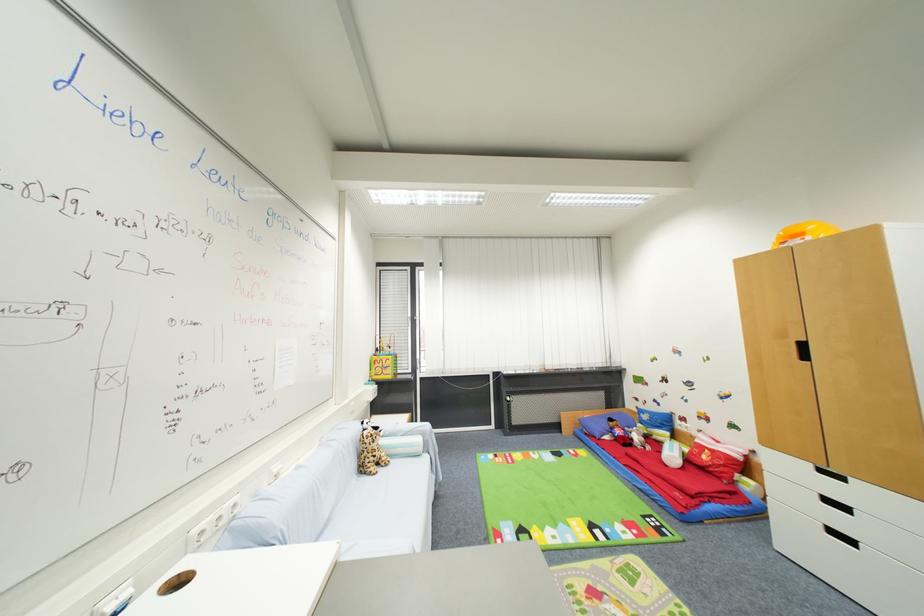
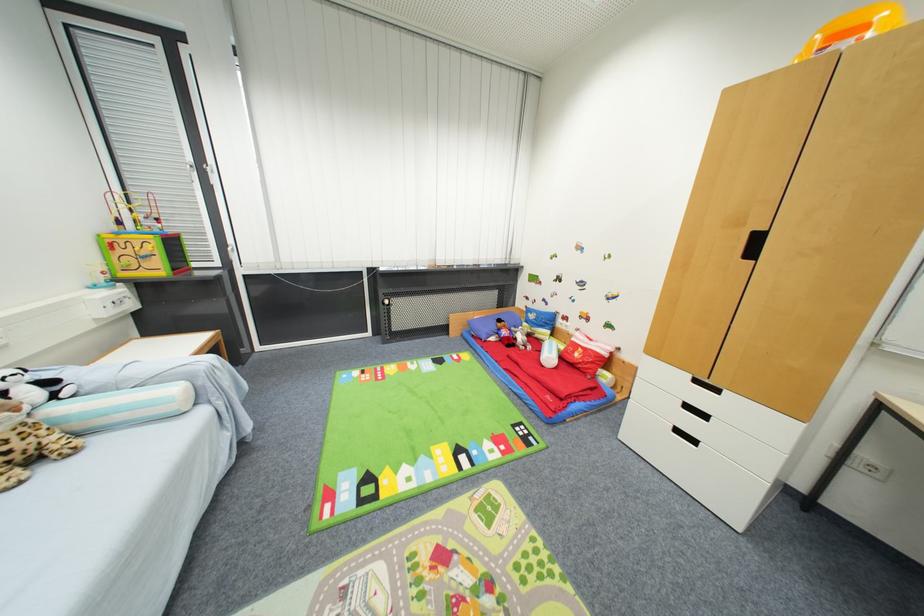
In the second image, find the point that corresponds to the point at 816,467 in the first image.

(695, 378)